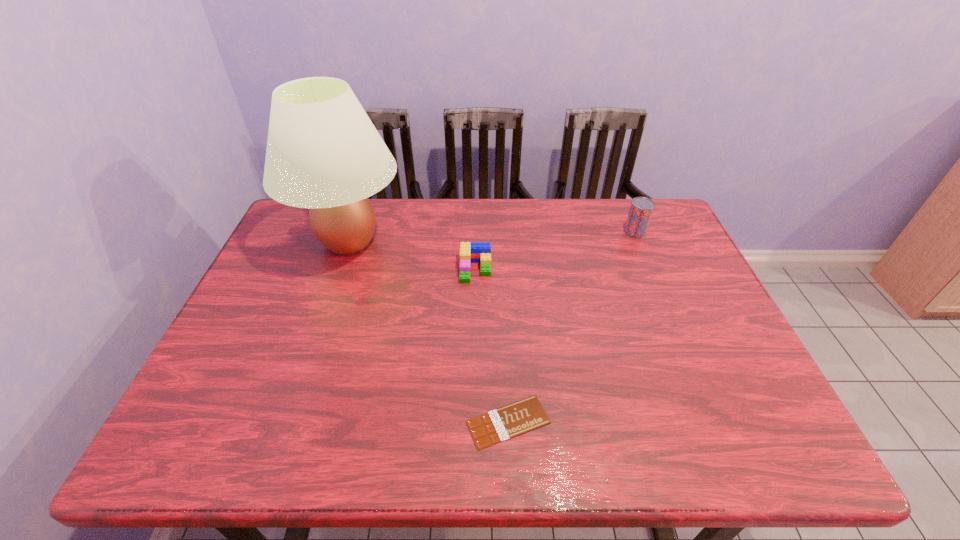
Locate an element on the screen. The image size is (960, 540). vacant position at the left edge of the desktop is located at coordinates (304, 264).

Locate an element on the screen. The height and width of the screenshot is (540, 960). vacant space at the right edge is located at coordinates (637, 249).

Find the location of a particular element. The width and height of the screenshot is (960, 540). vacant space at the near left corner of the desktop is located at coordinates (239, 423).

Where is `vacant area that lies between the Lego and the chocolate bar`? vacant area that lies between the Lego and the chocolate bar is located at coordinates (492, 346).

Where is `empty space between the chocolate bar and the Lego`? This screenshot has width=960, height=540. empty space between the chocolate bar and the Lego is located at coordinates (492, 346).

Locate an element on the screen. This screenshot has height=540, width=960. free space between the shortest object and the rightmost object is located at coordinates (571, 327).

The height and width of the screenshot is (540, 960). Identify the location of vacant space in between the chocolate bar and the rightmost object. pos(571,327).

Where is `free space between the shortest object and the tallest object`? The image size is (960, 540). free space between the shortest object and the tallest object is located at coordinates click(x=428, y=332).

Where is `empty space between the shortest object and the second shortest object`? The height and width of the screenshot is (540, 960). empty space between the shortest object and the second shortest object is located at coordinates (492, 346).

Locate an element on the screen. Image resolution: width=960 pixels, height=540 pixels. empty location between the nearest object and the rightmost object is located at coordinates (571, 327).